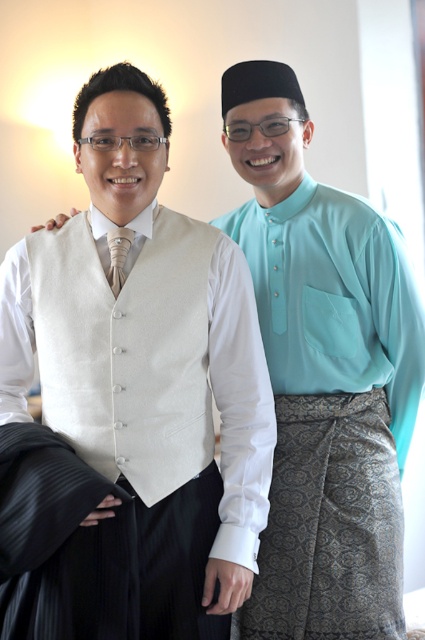
Where is the beige wool vest at center located in the image?

The beige wool vest at center is located at point (x=127, y=352) in the image.